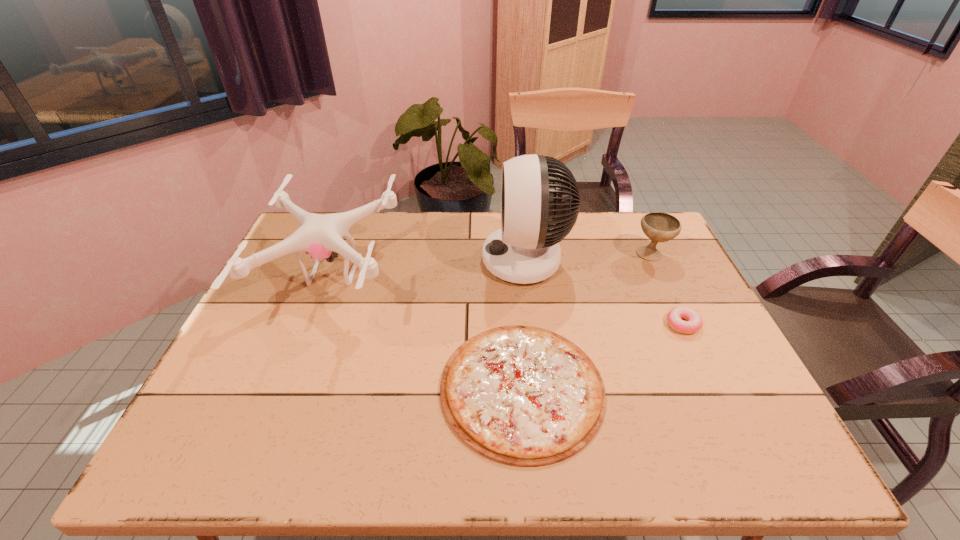
I want to click on object at the far left corner, so click(x=320, y=235).

This screenshot has width=960, height=540. Identify the location of object present at the far right corner. point(659,227).

The image size is (960, 540). I want to click on vacant region at the far edge of the desktop, so click(x=466, y=230).

Find the location of a particular element. The width and height of the screenshot is (960, 540). free region at the near edge of the desktop is located at coordinates (684, 433).

This screenshot has width=960, height=540. In order to click on vacant space at the left edge of the desktop in this screenshot , I will do `click(267, 294)`.

The width and height of the screenshot is (960, 540). I want to click on free spot at the right edge of the desktop, so click(695, 354).

Find the location of `blank space at the far right corner of the desktop`. blank space at the far right corner of the desktop is located at coordinates (636, 236).

At what (x,y) coordinates should I click in order to perform the action: click on vacant space at the near right corner of the desktop. Please return your answer as a coordinate pair (x, y). Looking at the image, I should click on (710, 462).

The image size is (960, 540). What are the coordinates of `free space between the second tallest object and the fan` in the screenshot? It's located at (429, 267).

You are a GUI agent. You are given a task and a screenshot of the screen. Output one action in this format:
    pyautogui.click(x=<x>, y=<y>)
    Task: Click on the free spot between the pizza and the fourth tallest object
    This screenshot has height=540, width=960.
    Given the screenshot: What is the action you would take?
    pyautogui.click(x=602, y=356)